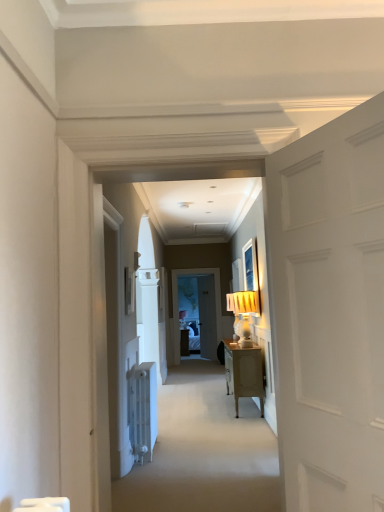
Where is `vacant space situated above carpet at center (from a real-world perspective)`? vacant space situated above carpet at center (from a real-world perspective) is located at coordinates (215, 457).